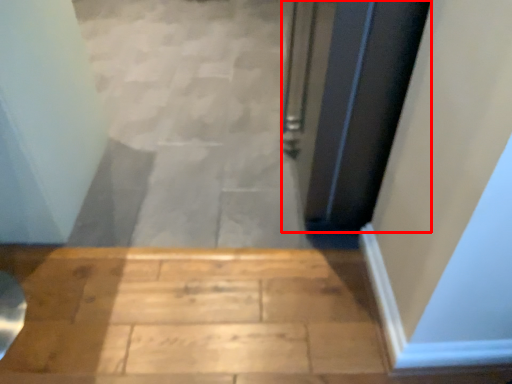
Question: In this image, where is door (annotated by the red box) located relative to stairwell?

Choices:
 (A) right
 (B) left

Answer: (A)